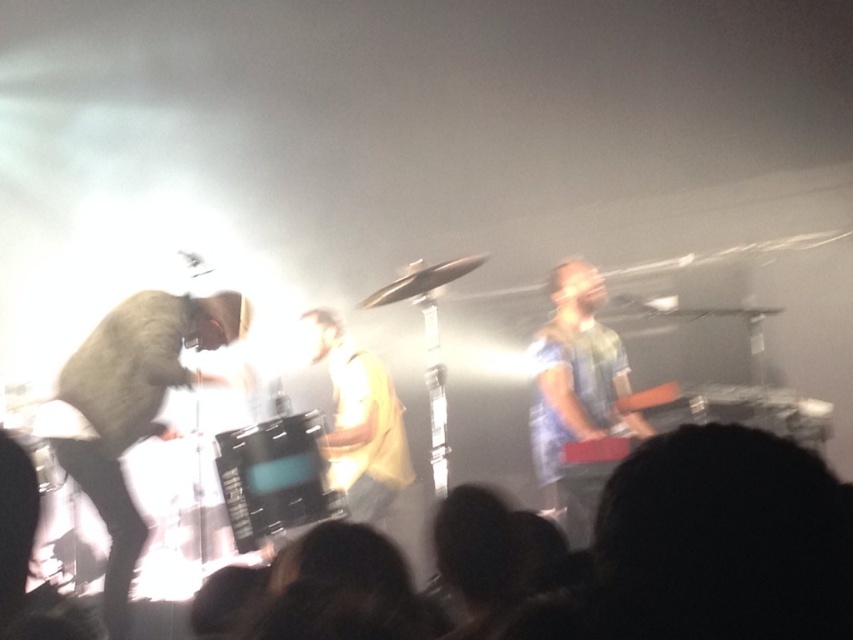
Based on the scene description, where is the light brown leather jacket at left located in the image? Please provide the coordinates as a point in the format of a tuple with two decimal numbers between 0 and 1, where 0 represents the bottom left corner and 1 represents the top right corner of the image.

The light brown leather jacket at left is located at point (131, 410) in the image.

In the scene shown: You are a photographer at the concert and want to take a clear photo of the light brown leather jacket at left. The camera you have requires a minimum distance of 10 feet to avoid motion blur. Based on the scene description, can you capture a clear photo without moving closer?

The light brown leather jacket at left and camera are 8.87 feet apart from each other. Since the required minimum distance is 10 feet, the photographer cannot capture a clear photo without moving closer.

You are a photographer at the concert. You want to capture a clear photo of the denim shirt at right without the light brown leather jacket at left blocking it. Is it possible to adjust your position to achieve this?

The denim shirt at right is behind the light brown leather jacket at left, so adjusting your position might not help as the denim shirt is obscured by the jacket from the current viewpoint. Consider moving to a position where you can see around or behind the light brown leather jacket at left to capture the denim shirt at right without obstruction.